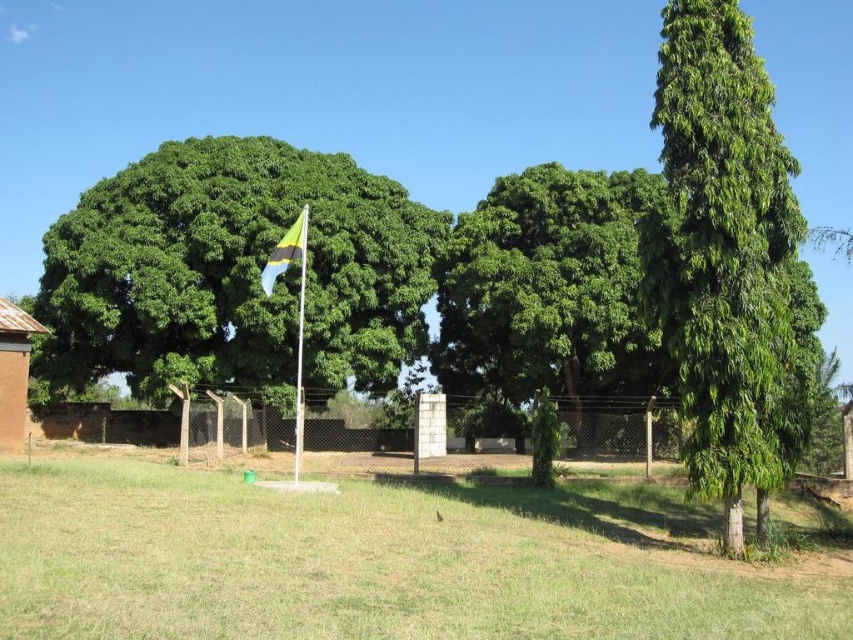
You are planning to plant a new tree in this area. Considering the existing green leafy tree at left and the green leafy tree at center, which one would cast a larger shadow in the afternoon sun?

The green leafy tree at left is much taller than the green leafy tree at center, so it would cast a larger shadow in the afternoon sun.

You are standing at the base of the flagpole in the image and want to walk directly to the green leafy tree at left. How far will you have to walk?

The green leafy tree at left and the viewer are 26.32 meters apart, so you will have to walk 26.32 meters to reach it.